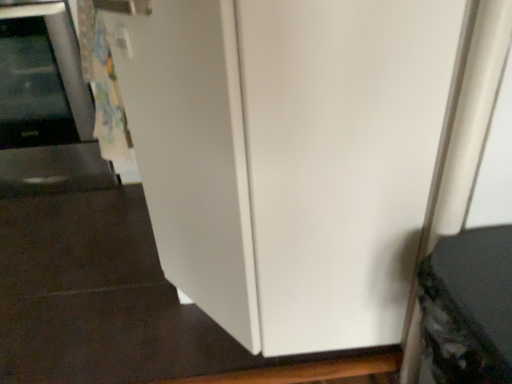
The height and width of the screenshot is (384, 512). In order to click on textured gray fabric at lower right, arranged as the first appliance when viewed from the front in this screenshot , I will do `click(468, 307)`.

Describe the element at coordinates (468, 307) in the screenshot. I see `textured gray fabric at lower right, which ranks as the second appliance in top-to-bottom order` at that location.

How much space does textured gray fabric at lower right, which is the first appliance from bottom to top, occupy horizontally?

The width of textured gray fabric at lower right, which is the first appliance from bottom to top, is 11.41 inches.

Identify the location of satin silver microwave at left, the second appliance ordered from the bottom. This screenshot has height=384, width=512. (45, 106).

What do you see at coordinates (45, 106) in the screenshot? I see `satin silver microwave at left, the second appliance ordered from the bottom` at bounding box center [45, 106].

At what (x,y) coordinates should I click in order to perform the action: click on textured gray fabric at lower right, which is the first appliance from bottom to top. Please return your answer as a coordinate pair (x, y). This screenshot has height=384, width=512. Looking at the image, I should click on 468,307.

Which object is positioned more to the right, textured gray fabric at lower right, the first appliance from the right, or satin silver microwave at left, which is counted as the first appliance, starting from the back?

textured gray fabric at lower right, the first appliance from the right.

Is textured gray fabric at lower right, which ranks as the second appliance in top-to-bottom order, further to the viewer compared to satin silver microwave at left, the second appliance ordered from the bottom?

No, textured gray fabric at lower right, which ranks as the second appliance in top-to-bottom order, is in front of satin silver microwave at left, the second appliance ordered from the bottom.

Which is in front, point (472, 351) or point (30, 173)?

The point (472, 351) is closer to the camera.

From the image's perspective, is textured gray fabric at lower right, which is the first appliance from bottom to top, above or below satin silver microwave at left, the 1th appliance from the left?

From the image's perspective, textured gray fabric at lower right, which is the first appliance from bottom to top, appears below satin silver microwave at left, the 1th appliance from the left.

From the picture: From a real-world perspective, which object stands above the other?

satin silver microwave at left, the second appliance ordered from the bottom.

Can you confirm if textured gray fabric at lower right, the 2th appliance in the left-to-right sequence, is wider than satin silver microwave at left, the 1th appliance from the left?

In fact, textured gray fabric at lower right, the 2th appliance in the left-to-right sequence, might be narrower than satin silver microwave at left, the 1th appliance from the left.

Looking at this image, is textured gray fabric at lower right, arranged as the first appliance when viewed from the front, taller or shorter than satin silver microwave at left, acting as the first appliance starting from the top?

In the image, textured gray fabric at lower right, arranged as the first appliance when viewed from the front, appears to be shorter than satin silver microwave at left, acting as the first appliance starting from the top.

Does textured gray fabric at lower right, arranged as the first appliance when viewed from the front, have a smaller size compared to satin silver microwave at left, acting as the first appliance starting from the top?

Yes.

Is satin silver microwave at left, the second appliance when ordered from front to back, surrounded by textured gray fabric at lower right, positioned as the second appliance in back-to-front order?

No, satin silver microwave at left, the second appliance when ordered from front to back, is not surrounded by textured gray fabric at lower right, positioned as the second appliance in back-to-front order.

Are textured gray fabric at lower right, which ranks as the second appliance in top-to-bottom order, and satin silver microwave at left, the second appliance ordered from the bottom, located far from each other?

Indeed, textured gray fabric at lower right, which ranks as the second appliance in top-to-bottom order, is not near satin silver microwave at left, the second appliance ordered from the bottom.

Is textured gray fabric at lower right, the 2th appliance in the left-to-right sequence, oriented towards satin silver microwave at left, the 1th appliance from the left?

No.

Measure the distance between textured gray fabric at lower right, positioned as the second appliance in back-to-front order, and satin silver microwave at left, acting as the first appliance starting from the top.

A distance of 1.35 meters exists between textured gray fabric at lower right, positioned as the second appliance in back-to-front order, and satin silver microwave at left, acting as the first appliance starting from the top.

The image size is (512, 384). In order to click on appliance above the textured gray fabric at lower right, positioned as the second appliance in back-to-front order (from the image's perspective) in this screenshot , I will do `click(45, 106)`.

Which object is positioned more to the left, satin silver microwave at left, the second appliance when ordered from front to back, or textured gray fabric at lower right, positioned as the second appliance in back-to-front order?

Positioned to the left is satin silver microwave at left, the second appliance when ordered from front to back.

Is satin silver microwave at left, the 1th appliance from the left, positioned before textured gray fabric at lower right, which ranks as the second appliance in top-to-bottom order?

No.

Which is behind, point (33, 89) or point (486, 227)?

The point (33, 89) is more distant.

From the image's perspective, relative to textured gray fabric at lower right, the first appliance from the right, is satin silver microwave at left, acting as the first appliance starting from the top, above or below?

Clearly, from the image's perspective, satin silver microwave at left, acting as the first appliance starting from the top, is above textured gray fabric at lower right, the first appliance from the right.

From a real-world perspective, relative to textured gray fabric at lower right, which ranks as the second appliance in top-to-bottom order, is satin silver microwave at left, the second appliance ordered from the bottom, vertically above or below?

In terms of real-world spatial position, satin silver microwave at left, the second appliance ordered from the bottom, is above textured gray fabric at lower right, which ranks as the second appliance in top-to-bottom order.

Which object is wider, satin silver microwave at left, the 1th appliance from the left, or textured gray fabric at lower right, positioned as the second appliance in back-to-front order?

With larger width is satin silver microwave at left, the 1th appliance from the left.

Is satin silver microwave at left, the 1th appliance from the left, shorter than textured gray fabric at lower right, which ranks as the second appliance in top-to-bottom order?

No, satin silver microwave at left, the 1th appliance from the left, is not shorter than textured gray fabric at lower right, which ranks as the second appliance in top-to-bottom order.

Who is smaller, satin silver microwave at left, which is counted as the first appliance, starting from the back, or textured gray fabric at lower right, arranged as the first appliance when viewed from the front?

Smaller between the two is textured gray fabric at lower right, arranged as the first appliance when viewed from the front.

Would you say satin silver microwave at left, which is the 2th appliance in right-to-left order, contains textured gray fabric at lower right, which is the first appliance from bottom to top?

No, textured gray fabric at lower right, which is the first appliance from bottom to top, is not a part of satin silver microwave at left, which is the 2th appliance in right-to-left order.

Is satin silver microwave at left, acting as the first appliance starting from the top, placed right next to textured gray fabric at lower right, the 2th appliance in the left-to-right sequence?

No, satin silver microwave at left, acting as the first appliance starting from the top, is not next to textured gray fabric at lower right, the 2th appliance in the left-to-right sequence.

Is satin silver microwave at left, the 1th appliance from the left, turned away from textured gray fabric at lower right, positioned as the second appliance in back-to-front order?

No, satin silver microwave at left, the 1th appliance from the left, is not facing away from textured gray fabric at lower right, positioned as the second appliance in back-to-front order.

How different are the orientations of satin silver microwave at left, which is counted as the first appliance, starting from the back, and textured gray fabric at lower right, positioned as the second appliance in back-to-front order, in degrees?

90 degrees separate the facing orientations of satin silver microwave at left, which is counted as the first appliance, starting from the back, and textured gray fabric at lower right, positioned as the second appliance in back-to-front order.

You are a GUI agent. You are given a task and a screenshot of the screen. Output one action in this format:
    pyautogui.click(x=<x>, y=<y>)
    Task: Click on the appliance beneath the satin silver microwave at left, the 1th appliance from the left (from a real-world perspective)
    This screenshot has width=512, height=384.
    Given the screenshot: What is the action you would take?
    pyautogui.click(x=468, y=307)

You are a GUI agent. You are given a task and a screenshot of the screen. Output one action in this format:
    pyautogui.click(x=<x>, y=<y>)
    Task: Click on the appliance that is above the textured gray fabric at lower right, the first appliance from the right (from a real-world perspective)
    The height and width of the screenshot is (384, 512).
    Given the screenshot: What is the action you would take?
    pyautogui.click(x=45, y=106)

The image size is (512, 384). In order to click on appliance that appears behind the textured gray fabric at lower right, which is the first appliance from bottom to top in this screenshot , I will do `click(45, 106)`.